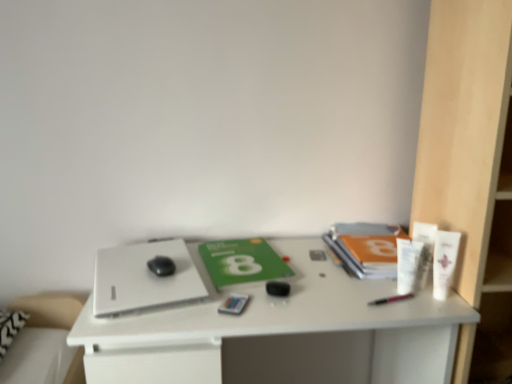
The height and width of the screenshot is (384, 512). Identify the location of vacant space that's between green matte paperback book at center, the second paperback book in the right-to-left sequence, and black plastic pen at center, which is counted as the 2th stationery, starting from the left. (325, 284).